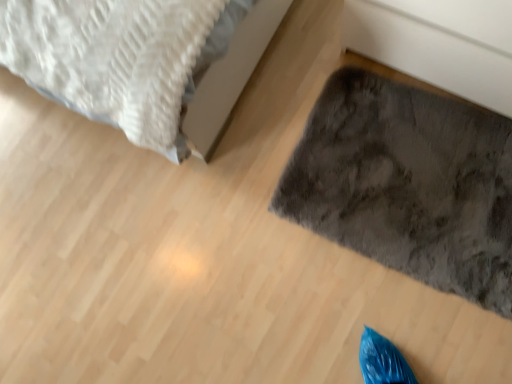
What do you see at coordinates (407, 184) in the screenshot? The height and width of the screenshot is (384, 512). I see `gray fluffy rug at lower right` at bounding box center [407, 184].

Find the location of a particular element. The image size is (512, 384). gray fluffy rug at lower right is located at coordinates (407, 184).

Identify the location of gray fluffy rug at lower right. This screenshot has height=384, width=512. (407, 184).